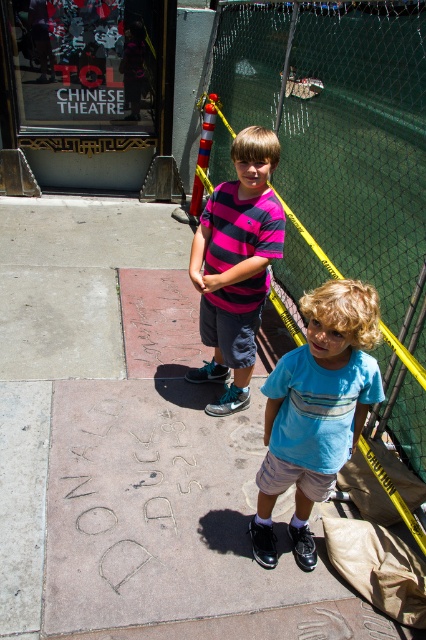
Question: Is concrete sidewalk at center above pink striped shirt at center?

Choices:
 (A) no
 (B) yes

Answer: (A)

Question: Among these points, which one is farthest from the camera?

Choices:
 (A) (16, 609)
 (B) (350, 353)
 (C) (190, 276)

Answer: (C)

Question: Is concrete sidewalk at center positioned at the back of blue cotton shirt at center?

Choices:
 (A) yes
 (B) no

Answer: (A)

Question: Which of the following is the farthest from the observer?

Choices:
 (A) blue cotton shirt at center
 (B) yellow/yellow mesh fence at upper center
 (C) concrete sidewalk at center
 (D) pink striped shirt at center

Answer: (D)

Question: Which point is closer to the camera?

Choices:
 (A) (265, 524)
 (B) (290, 131)

Answer: (A)

Question: Can you confirm if yellow/yellow mesh fence at upper center is positioned to the right of pink striped shirt at center?

Choices:
 (A) no
 (B) yes

Answer: (B)